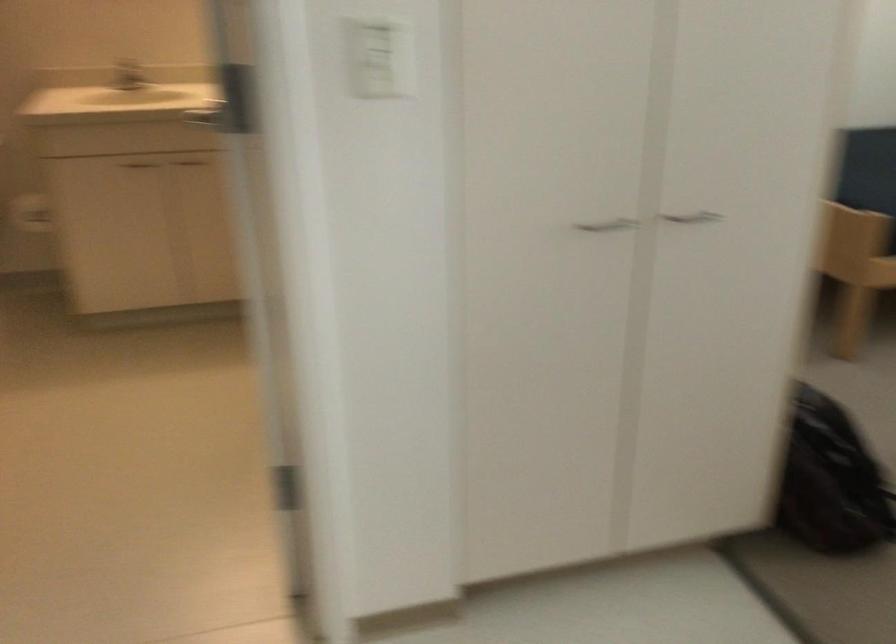
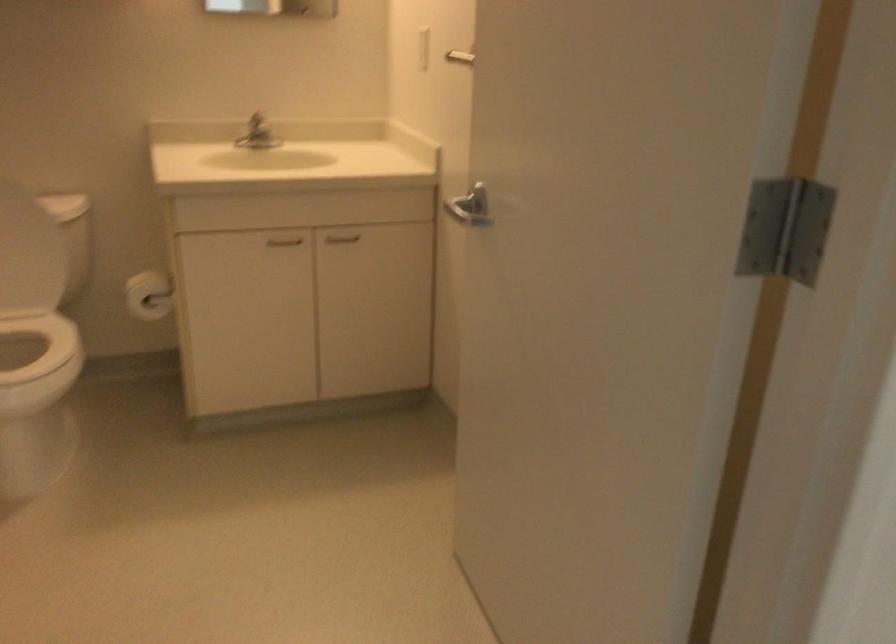
In the second image, find the point that corresponds to point 186,162 in the first image.

(341, 238)